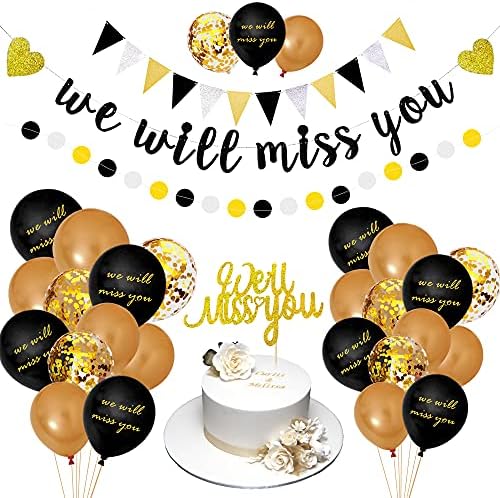
Identify the location of "we will miss you" banner. This screenshot has width=500, height=498. (250, 145).